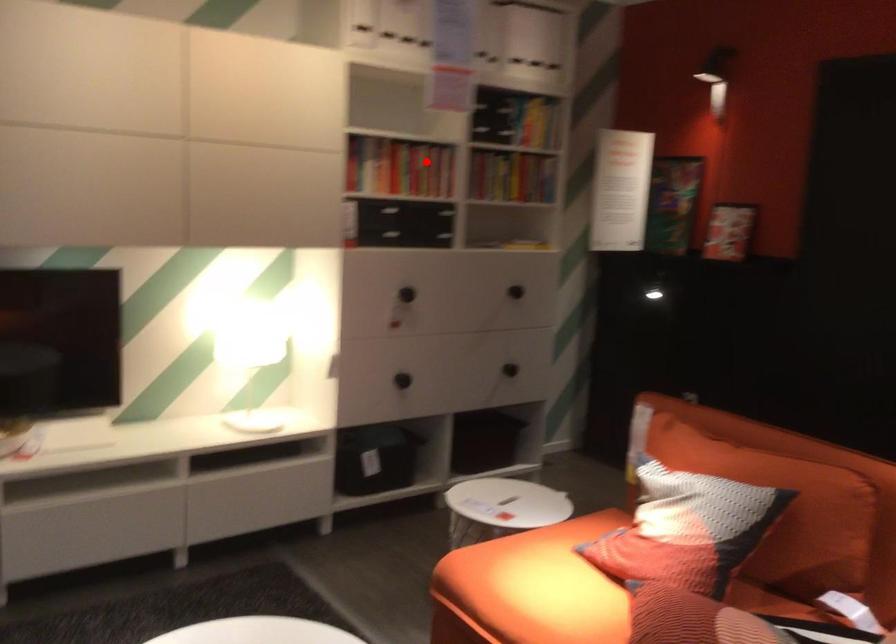
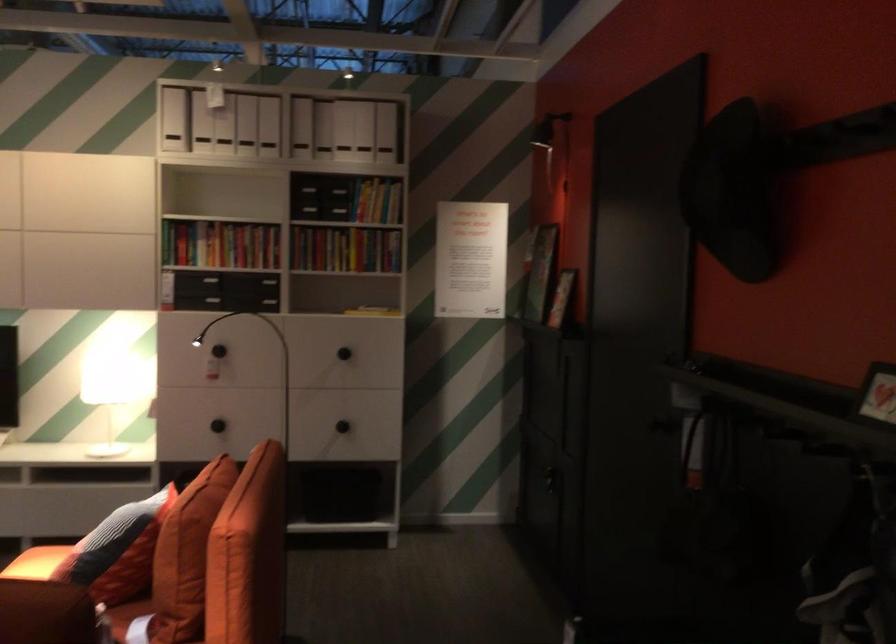
Where in the second image is the point corresponding to the highlighted location from the first image?

(220, 243)